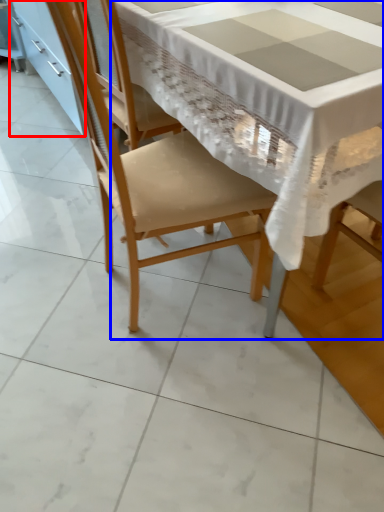
Question: Which point is further to the camera, cabinetry (highlighted by a red box) or table (highlighted by a blue box)?

Choices:
 (A) cabinetry
 (B) table

Answer: (A)